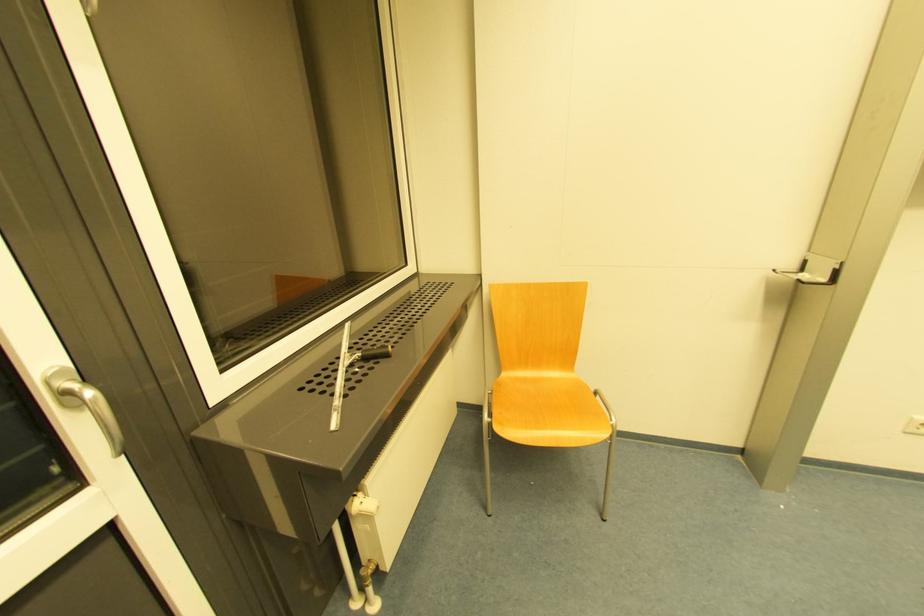
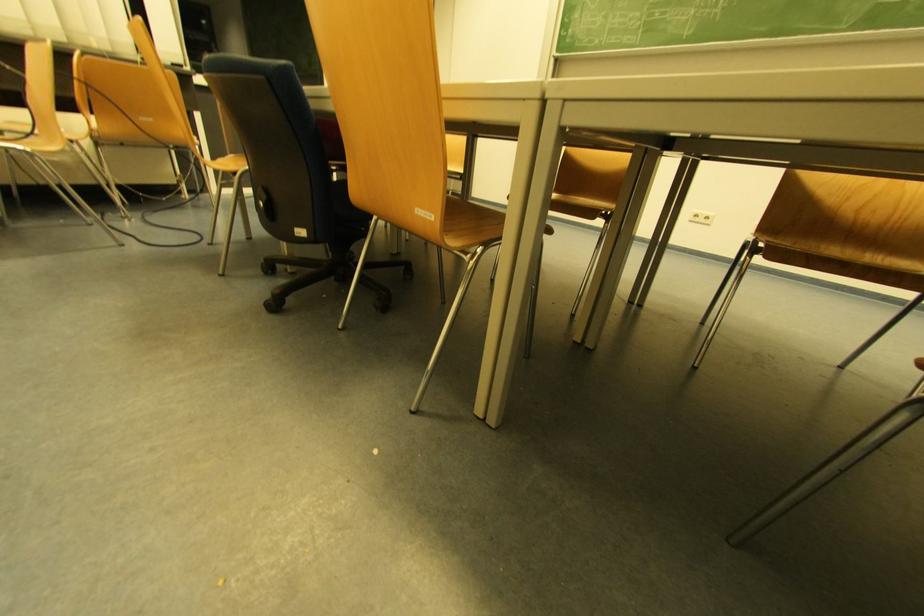
In a continuous first-person perspective shot, in which direction is the camera moving?

The cameraman moved toward right, backward.